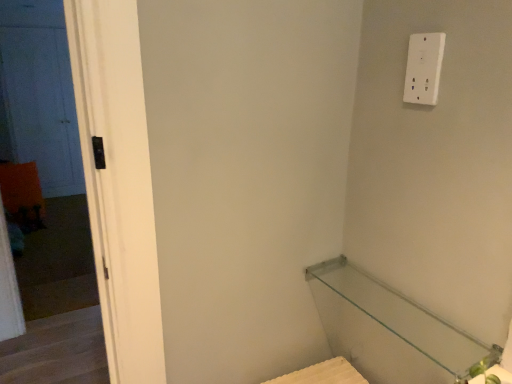
Question: Considering the relative sizes of black matte door at left and transparent glass shelf at lower right in the image provided, is black matte door at left bigger than transparent glass shelf at lower right?

Choices:
 (A) no
 (B) yes

Answer: (B)

Question: Is the surface of black matte door at left in direct contact with transparent glass shelf at lower right?

Choices:
 (A) yes
 (B) no

Answer: (B)

Question: Is black matte door at left positioned before transparent glass shelf at lower right?

Choices:
 (A) no
 (B) yes

Answer: (A)

Question: Would you say black matte door at left is outside transparent glass shelf at lower right?

Choices:
 (A) yes
 (B) no

Answer: (A)

Question: Is black matte door at left shorter than transparent glass shelf at lower right?

Choices:
 (A) yes
 (B) no

Answer: (B)

Question: Is black matte door at left inside or outside of white plastic light switch at upper right?

Choices:
 (A) inside
 (B) outside

Answer: (B)

Question: In the image, is black matte door at left positioned in front of or behind white plastic light switch at upper right?

Choices:
 (A) front
 (B) behind

Answer: (B)

Question: Is point (12, 9) closer or farther from the camera than point (424, 72)?

Choices:
 (A) farther
 (B) closer

Answer: (A)

Question: From the image's perspective, is black matte door at left located above or below white plastic light switch at upper right?

Choices:
 (A) below
 (B) above

Answer: (A)

Question: In the image, is white matte door at left positioned in front of or behind black matte door at left?

Choices:
 (A) behind
 (B) front

Answer: (A)

Question: In terms of width, does white matte door at left look wider or thinner when compared to black matte door at left?

Choices:
 (A) thin
 (B) wide

Answer: (A)

Question: In the image, is white matte door at left on the left side or the right side of black matte door at left?

Choices:
 (A) right
 (B) left

Answer: (B)

Question: Is white matte door at left spatially inside black matte door at left, or outside of it?

Choices:
 (A) outside
 (B) inside

Answer: (A)

Question: In terms of size, does white matte door at left appear bigger or smaller than transparent glass shelf at lower right?

Choices:
 (A) big
 (B) small

Answer: (A)

Question: Based on their positions, is white matte door at left located to the left or right of transparent glass shelf at lower right?

Choices:
 (A) right
 (B) left

Answer: (B)